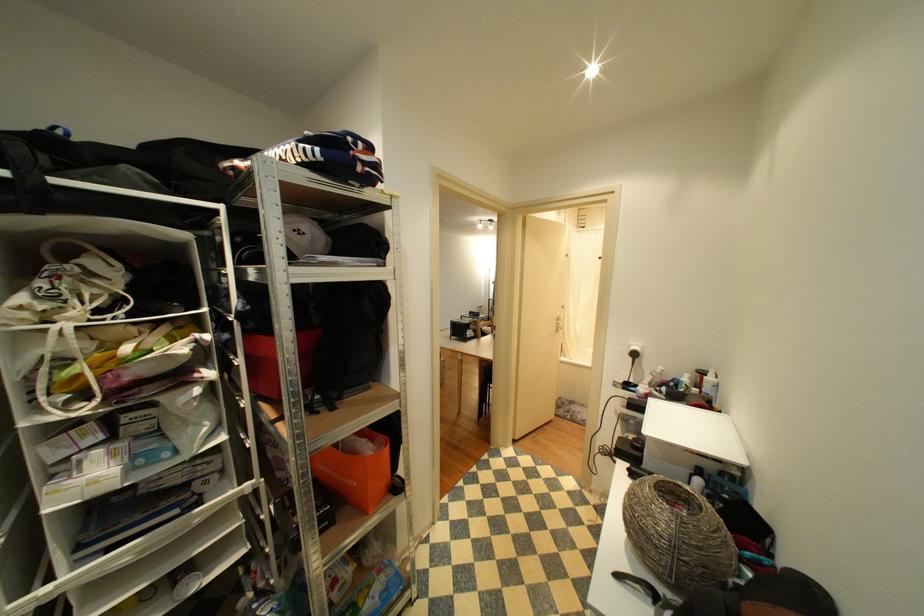
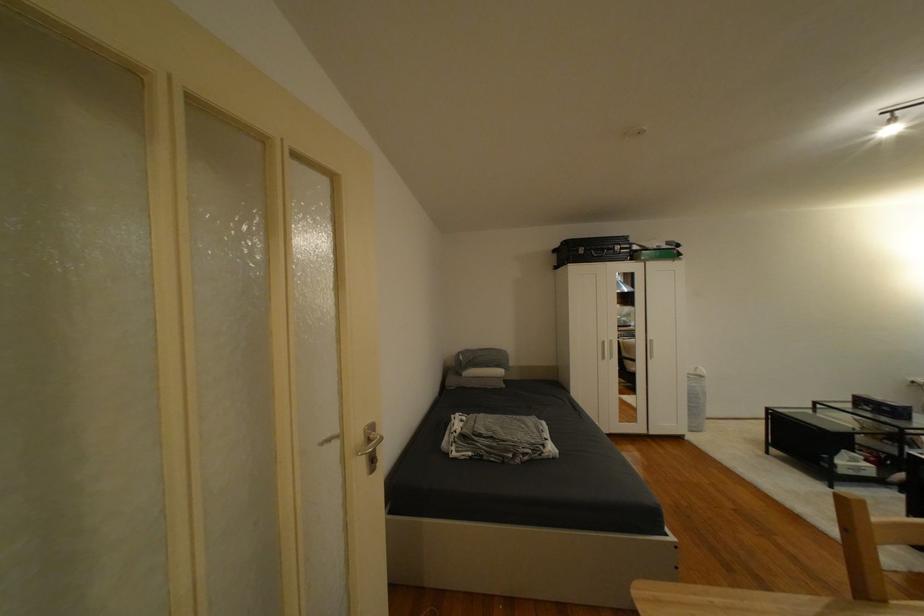
Where in the second image is the point corresponding to pixel 483 315 from the first image?

(894, 410)